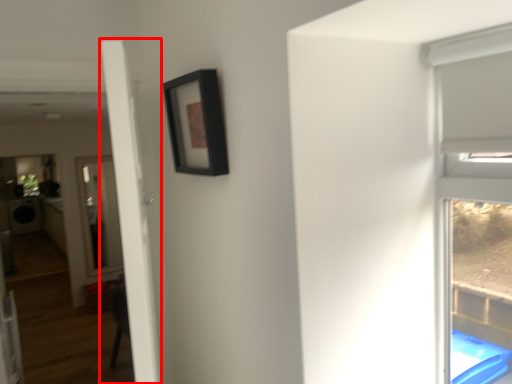
Question: From the image's perspective, where is door (annotated by the red box) located in relation to picture frame in the image?

Choices:
 (A) below
 (B) above

Answer: (A)